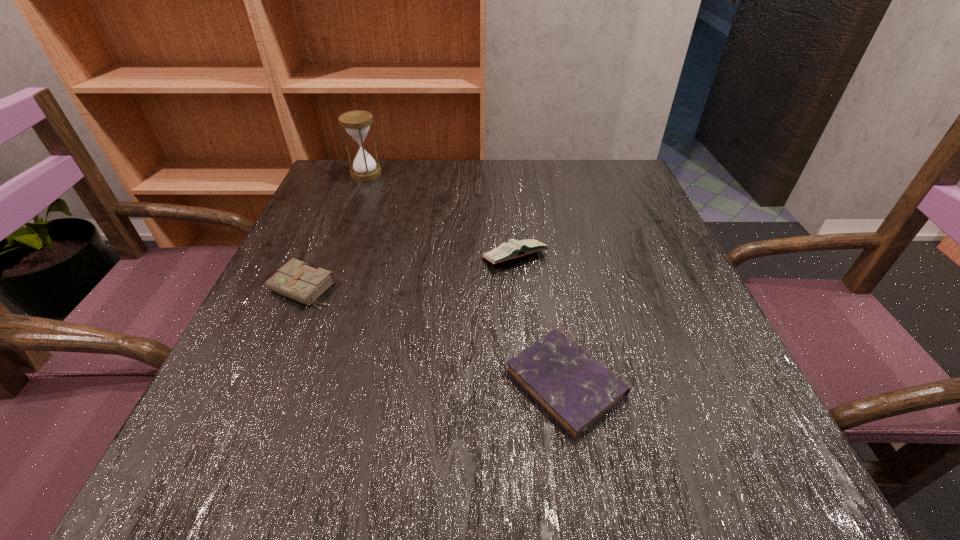
Where is `free space between the second tallest diary and the tallest object`? This screenshot has height=540, width=960. free space between the second tallest diary and the tallest object is located at coordinates (334, 231).

The height and width of the screenshot is (540, 960). I want to click on free space between the nearest object and the tallest object, so click(466, 278).

Identify which object is located as the second nearest to the tallest diary. Please provide its 2D coordinates. Your answer should be formatted as a tuple, i.e. [(x, y)], where the tuple contains the x and y coordinates of a point satisfying the conditions above.

[(295, 280)]

Choose which object is the third nearest neighbor to the tallest object. Please provide its 2D coordinates. Your answer should be formatted as a tuple, i.e. [(x, y)], where the tuple contains the x and y coordinates of a point satisfying the conditions above.

[(575, 389)]

Image resolution: width=960 pixels, height=540 pixels. I want to click on the closest diary relative to the nearest diary, so click(513, 249).

Select which diary is the second closest to the farthest object. Please provide its 2D coordinates. Your answer should be formatted as a tuple, i.e. [(x, y)], where the tuple contains the x and y coordinates of a point satisfying the conditions above.

[(513, 249)]

Image resolution: width=960 pixels, height=540 pixels. I want to click on vacant space that satisfies the following two spatial constraints: 1. on the back side of the second shortest object; 2. on the left side of the farthest object, so click(x=352, y=173).

What are the coordinates of `vacant space that satisfies the following two spatial constraints: 1. on the back side of the third tallest object; 2. on the right side of the farthest object` in the screenshot? It's located at (352, 173).

You are a GUI agent. You are given a task and a screenshot of the screen. Output one action in this format:
    pyautogui.click(x=<x>, y=<y>)
    Task: Click on the free location that satisfies the following two spatial constraints: 1. on the front side of the nearest diary; 2. on the right side of the second shortest diary
    The image size is (960, 540).
    Given the screenshot: What is the action you would take?
    pos(261,382)

Find the location of a particular element. This screenshot has height=540, width=960. vacant space that satisfies the following two spatial constraints: 1. on the front side of the farthest object; 2. on the left side of the shortest object is located at coordinates (285, 382).